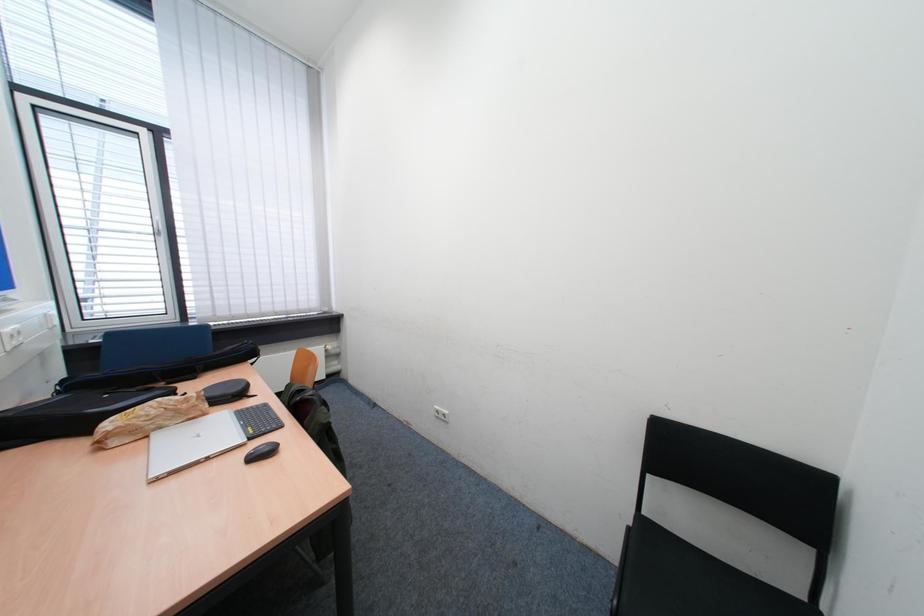
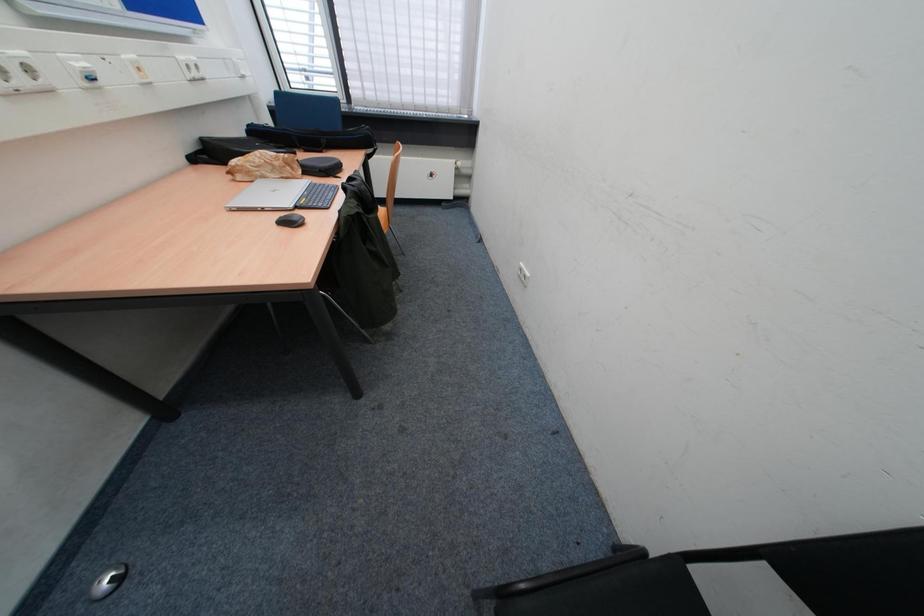
Based on the photo, first-person continuous shooting, in which direction is the camera rotating?

The camera's rotation is toward left-down.